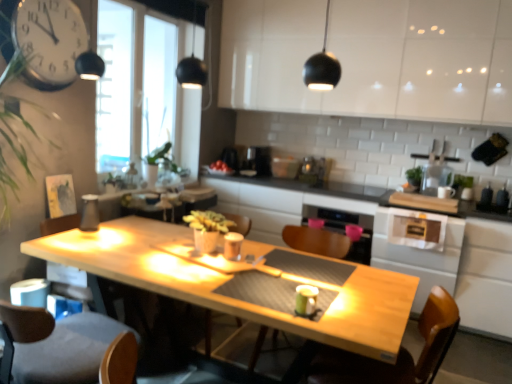
Question: Considering the positions of point (97, 225) and point (246, 221), is point (97, 225) closer or farther from the camera than point (246, 221)?

Choices:
 (A) farther
 (B) closer

Answer: (B)

Question: Considering the positions of matte glass carafe at left, the third appliance when ordered from right to left, and wooden armchair at center, the second armchair when ordered from right to left, in the image, is matte glass carafe at left, the third appliance when ordered from right to left, wider or thinner than wooden armchair at center, the second armchair when ordered from right to left,?

Choices:
 (A) wide
 (B) thin

Answer: (B)

Question: Which is farther from the black plastic coffee machine at center?

Choices:
 (A) matte glass carafe at left, the first appliance in the left-to-right sequence
 (B) green leafy plant at upper left
 (C) metallic silver clock at upper left
 (D) white glossy cabinet at upper center
 (E) wooden table at center

Answer: (C)

Question: Which object is the farthest from the metallic silver toaster at upper center, acting as the 1th appliance starting from the top?

Choices:
 (A) green leafy plant at upper left
 (B) metallic silver clock at upper left
 (C) dark brown leather swivel chair at lower left, which is the first swivel chair from left to right
 (D) wooden armchair at center, the second armchair when ordered from right to left
 (E) black plastic coffee machine at center

Answer: (C)